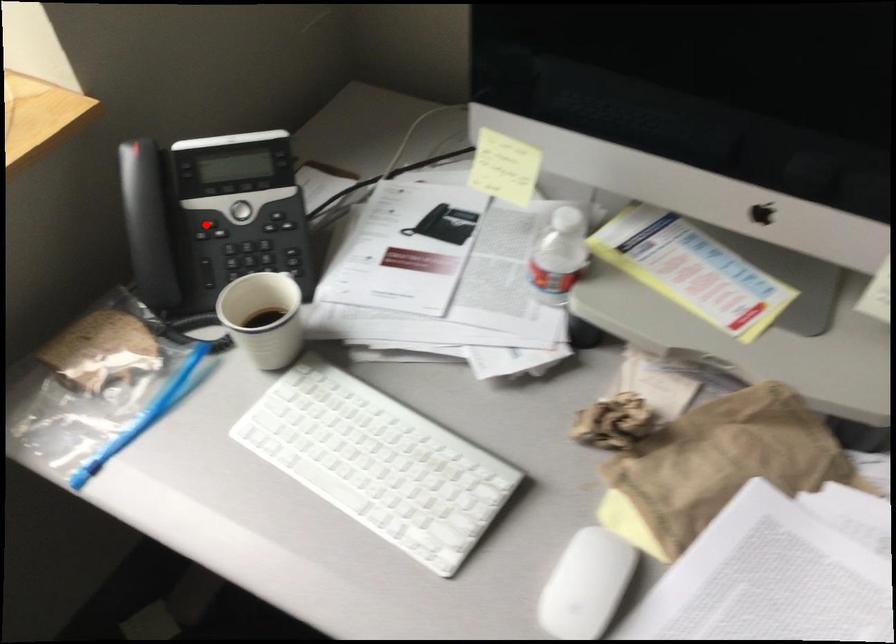
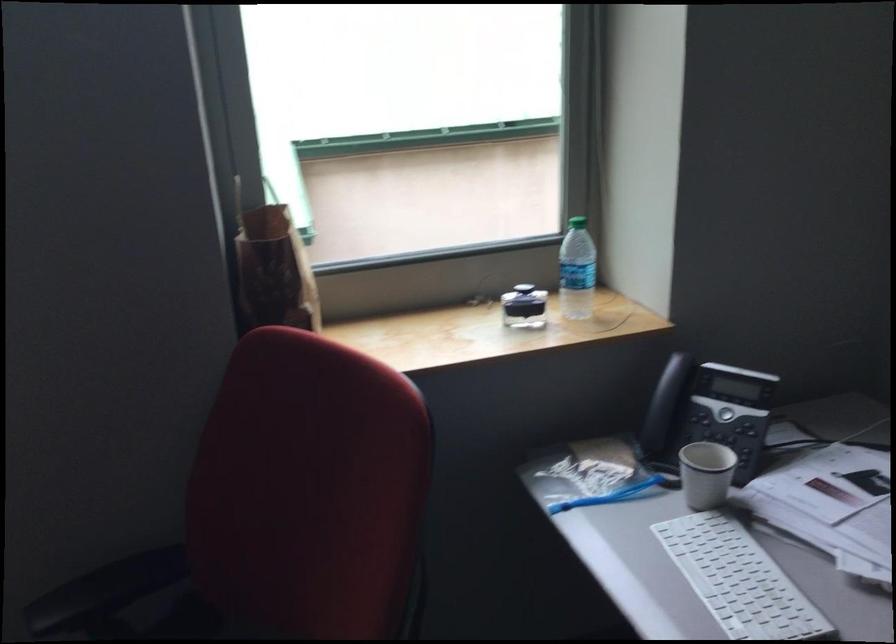
Find the pixel in the second image that matches the highlighted location in the first image.

(707, 413)